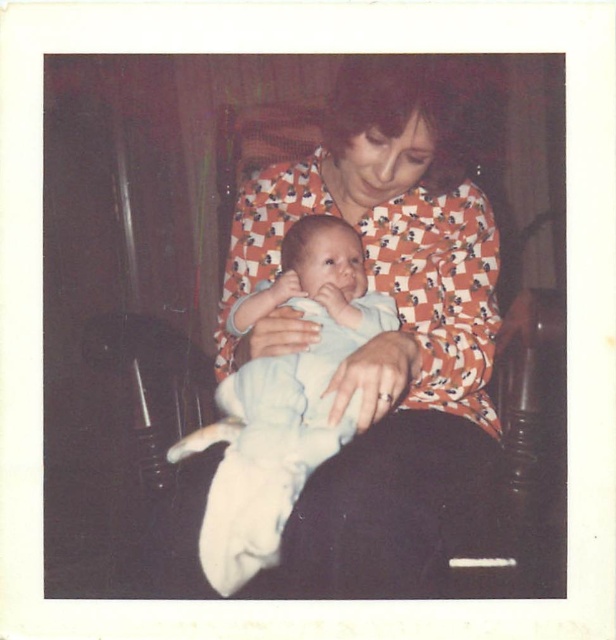
Question: Considering the relative positions of orange printed blouse at center and light blue cotton baby at center in the image provided, where is orange printed blouse at center located with respect to light blue cotton baby at center?

Choices:
 (A) above
 (B) below

Answer: (A)

Question: Is orange printed blouse at center to the left of light blue cotton baby at center from the viewer's perspective?

Choices:
 (A) yes
 (B) no

Answer: (B)

Question: Does orange printed blouse at center have a smaller size compared to light blue cotton baby at center?

Choices:
 (A) yes
 (B) no

Answer: (B)

Question: Which object appears farthest from the camera in this image?

Choices:
 (A) orange printed blouse at center
 (B) light blue cotton baby at center

Answer: (A)